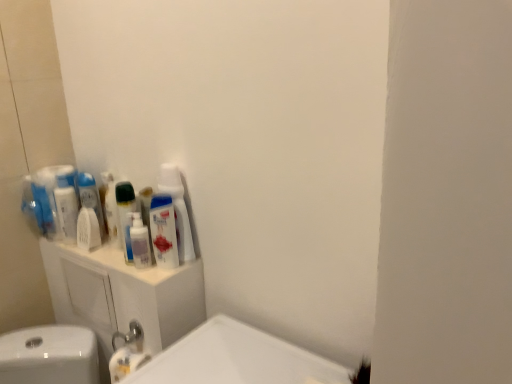
The height and width of the screenshot is (384, 512). I want to click on free point in front of white matte mouthwash at left, the 3th mouthwash when ordered from left to right, so click(x=99, y=260).